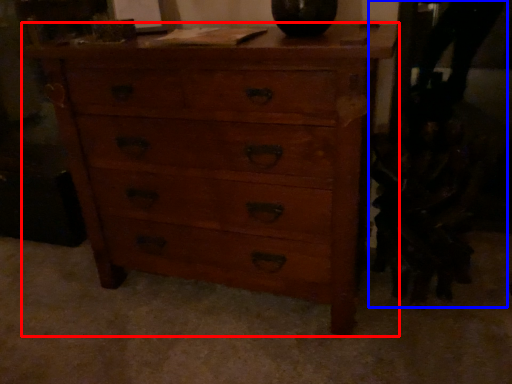
Question: Which object appears closest to the camera in this image, chest of drawers (highlighted by a red box) or swivel chair (highlighted by a blue box)?

Choices:
 (A) chest of drawers
 (B) swivel chair

Answer: (A)